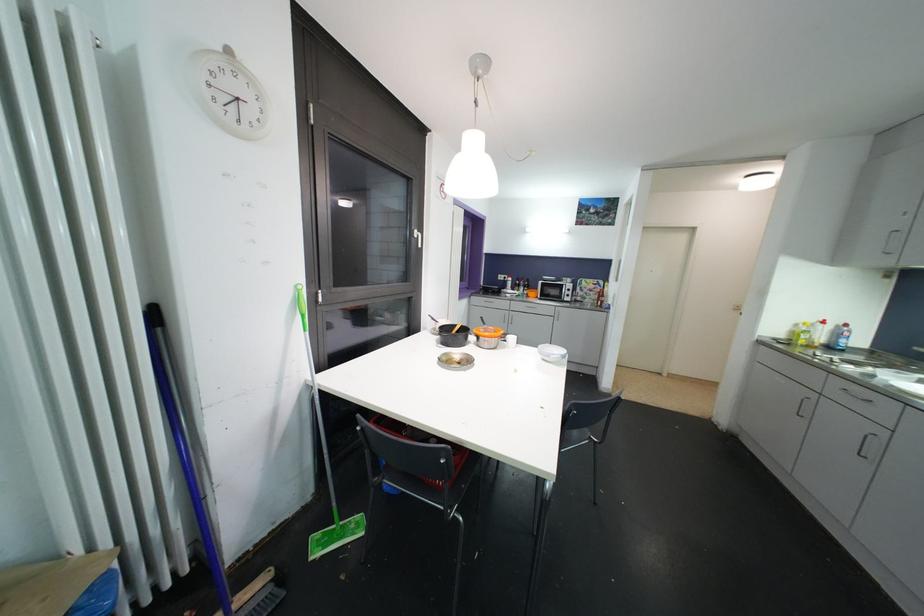
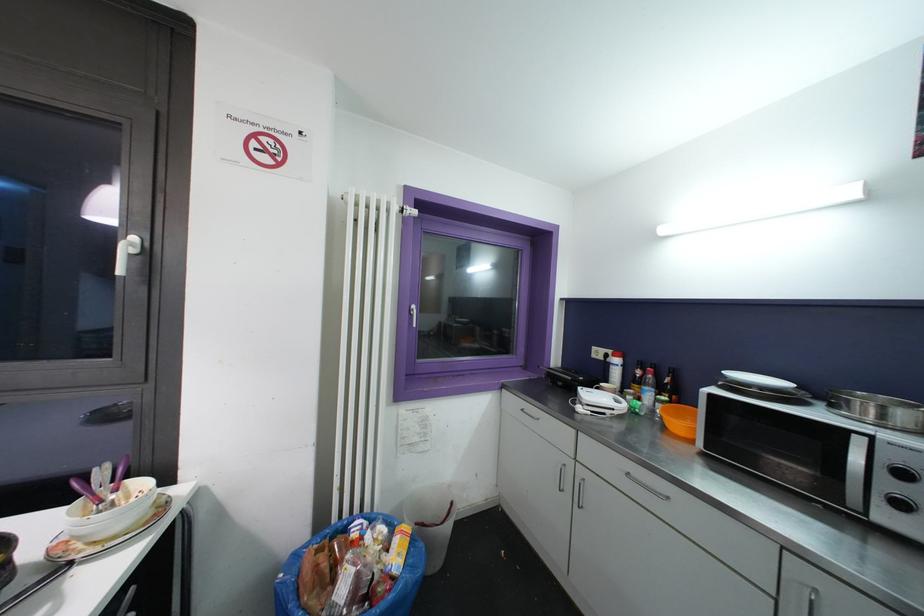
Locate, in the second image, the point that corresponds to pixel 521 288 in the first image.

(642, 385)